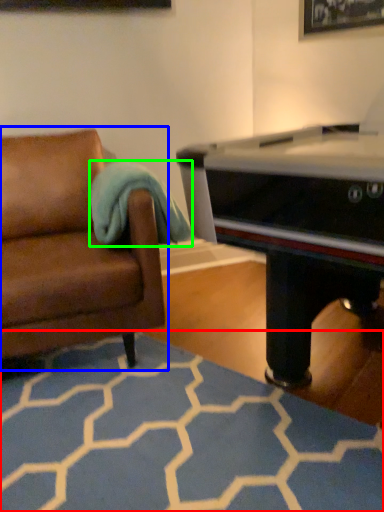
Question: Which object is the farthest from plain (highlighted by a red box)? Choose among these: studio couch (highlighted by a blue box) or blanket (highlighted by a green box).

Choices:
 (A) studio couch
 (B) blanket

Answer: (B)